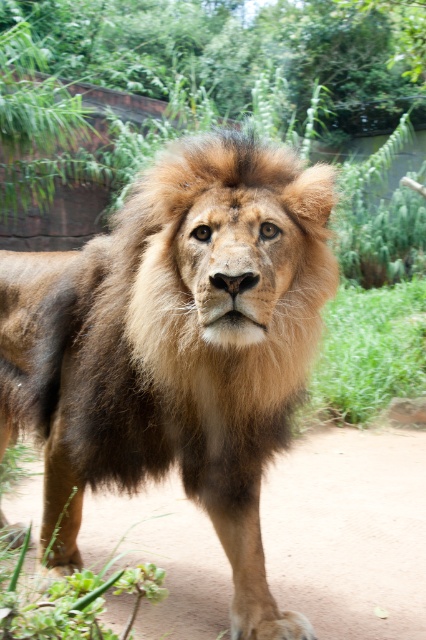
You are a zookeeper observing the lion in its enclosure. You notice a point marked at coordinates (175, 348). Based on the scene description, where is this point located in relation to the brown fuzzy lion at center?

The point at coordinates (175, 348) is located at the center of the brown fuzzy lion at center, as it marks its position.

You are a zookeeper observing the brown fuzzy lion at center and the brown furry leg at center in the enclosure. Which object is bigger?

The brown fuzzy lion at center is larger in size than the brown furry leg at center.

You are a photographer standing in front of the lion. You want to take a photo of the lion but need to stay at least 2 meters away for safety. Is the point where you are standing at point (158, 305) within the safe distance?

The point (158, 305) is 1.84 meters away from the camera, which is less than the required 2 meters for safety. Therefore, you are too close and should move back to ensure a safe distance.